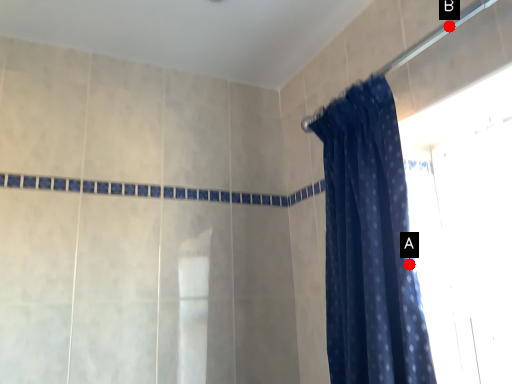
Question: Two points are circled on the image, labeled by A and B beside each circle. Which point appears closest to the camera in this image?

Choices:
 (A) A is closer
 (B) B is closer

Answer: (A)